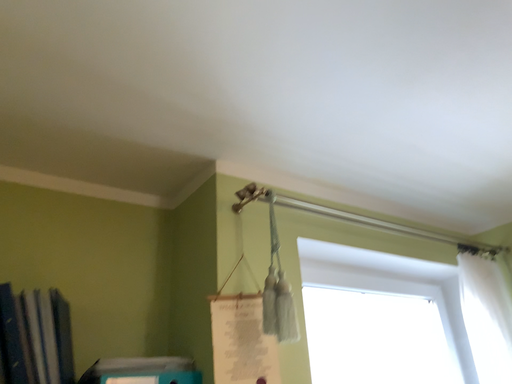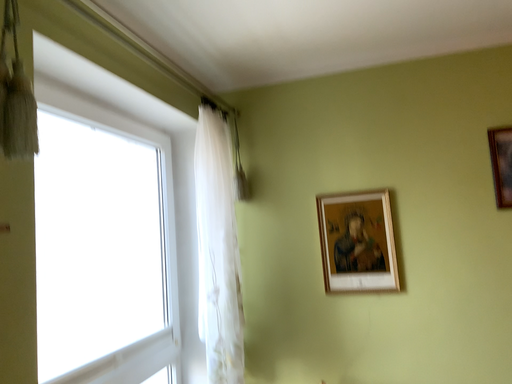
Question: Which way did the camera rotate in the video?

Choices:
 (A) rotated downward
 (B) rotated upward

Answer: (A)